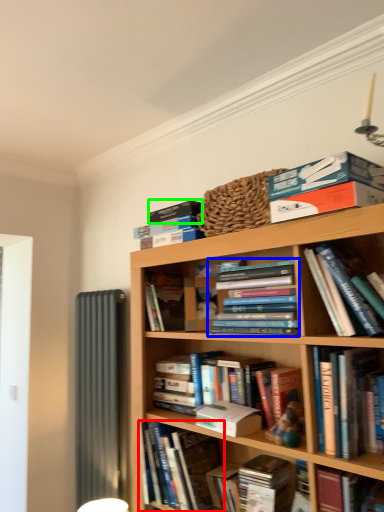
Question: Which object is positioned farthest from book (highlighted by a red box)? Select from book (highlighted by a blue box) and paperback book (highlighted by a green box).

Choices:
 (A) book
 (B) paperback book

Answer: (B)